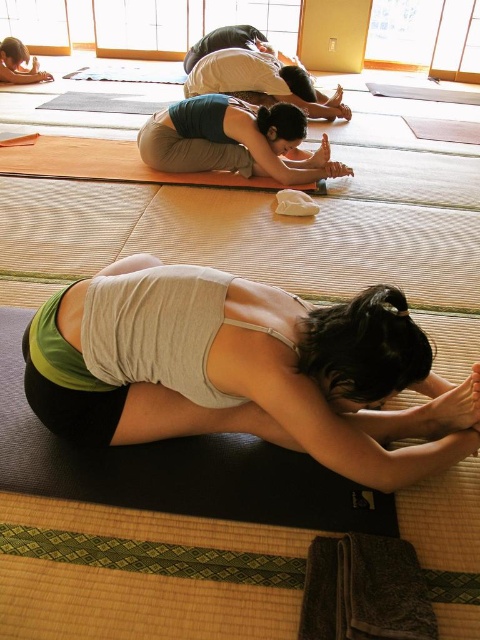
Question: Which point appears farthest from the camera in this image?

Choices:
 (A) (214, 384)
 (B) (226, 136)

Answer: (B)

Question: Is white matte tank top at center smaller than teal fabric yoga mat at center?

Choices:
 (A) yes
 (B) no

Answer: (B)

Question: Is white matte tank top at center thinner than teal fabric yoga mat at center?

Choices:
 (A) no
 (B) yes

Answer: (B)

Question: Is white matte tank top at center wider than teal fabric yoga mat at center?

Choices:
 (A) no
 (B) yes

Answer: (A)

Question: Which point is closer to the camera taking this photo?

Choices:
 (A) (62, 326)
 (B) (257, 134)

Answer: (A)